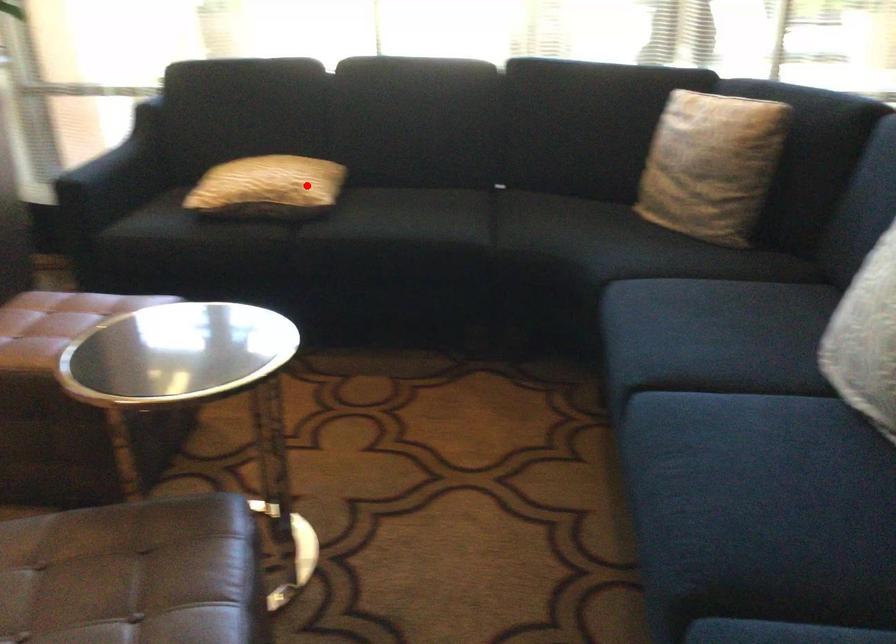
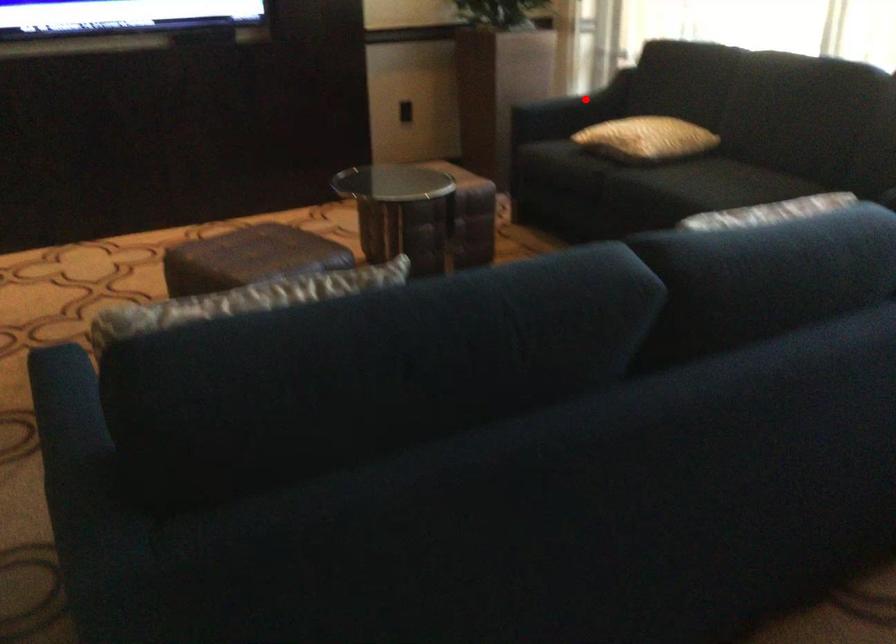
I am providing you with two images of the same scene from different viewpoints. A red point is marked on the first image and another point is marked on the second image. Is the marked point in image1 the same physical position as the marked point in image2?

No